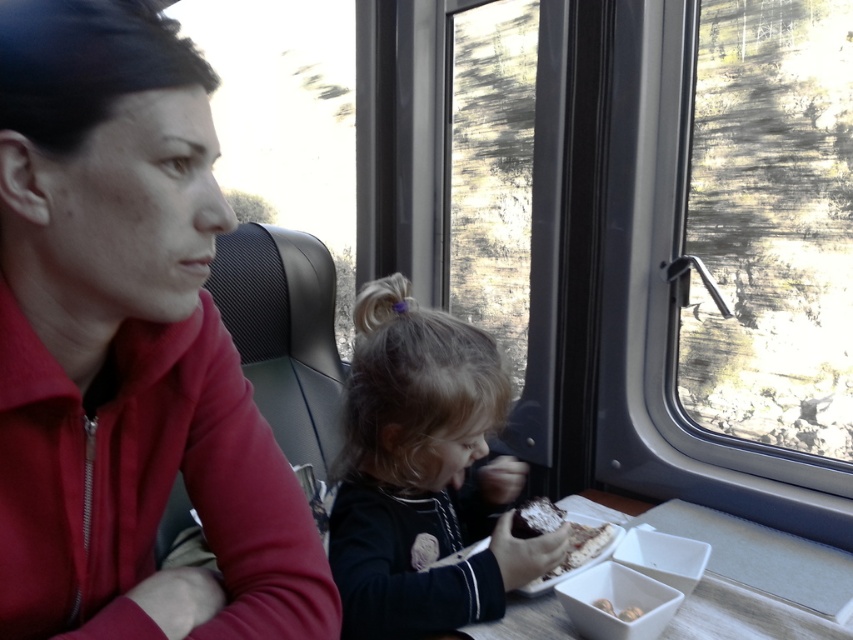
You are a passenger in the train car and you want to know which object is larger between the dark brown hair at center and the crumbly brown bread at lower center. Can you tell me?

The dark brown hair at center is bigger than the crumbly brown bread at lower center according to the description.